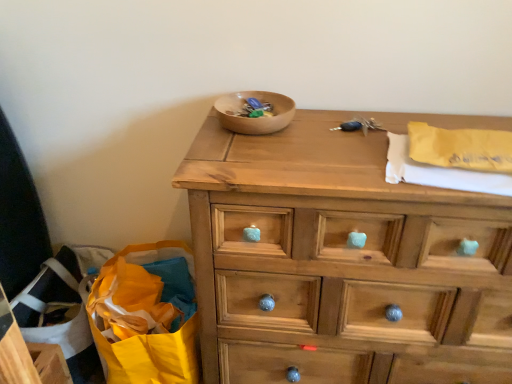
Identify the location of free space in front of wooden bowl at center. (262, 153).